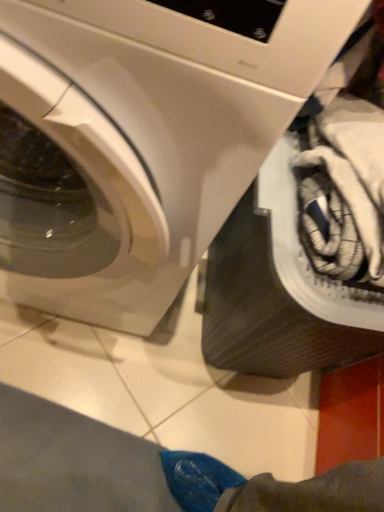
Describe the element at coordinates (266, 309) in the screenshot. I see `black rubber tire at lower right` at that location.

The width and height of the screenshot is (384, 512). Find the location of `black rubber tire at lower right`. black rubber tire at lower right is located at coordinates (266, 309).

The width and height of the screenshot is (384, 512). Describe the element at coordinates (141, 137) in the screenshot. I see `white glossy washing machine at upper left` at that location.

At what (x,y) coordinates should I click in order to perform the action: click on white glossy washing machine at upper left. Please return your answer as a coordinate pair (x, y). This screenshot has height=512, width=384. Looking at the image, I should click on (141, 137).

From the picture: Measure the distance between point [222,134] and camera.

Point [222,134] is 14.33 inches from camera.

Find the location of a particular element. The width and height of the screenshot is (384, 512). black rubber tire at lower right is located at coordinates (266, 309).

Considering the positions of objects black rubber tire at lower right and white glossy washing machine at upper left in the image provided, who is more to the right, black rubber tire at lower right or white glossy washing machine at upper left?

black rubber tire at lower right.

Is black rubber tire at lower right closer to camera compared to white glossy washing machine at upper left?

No, black rubber tire at lower right is behind white glossy washing machine at upper left.

Which is behind, point (255, 312) or point (231, 170)?

The point (255, 312) is farther.

From the image's perspective, which is below, black rubber tire at lower right or white glossy washing machine at upper left?

black rubber tire at lower right is shown below in the image.

From a real-world perspective, which is physically below, black rubber tire at lower right or white glossy washing machine at upper left?

black rubber tire at lower right, from a real-world perspective.

Can you confirm if black rubber tire at lower right is thinner than white glossy washing machine at upper left?

Correct, the width of black rubber tire at lower right is less than that of white glossy washing machine at upper left.

Between black rubber tire at lower right and white glossy washing machine at upper left, which one has less height?

black rubber tire at lower right is shorter.

Is black rubber tire at lower right bigger or smaller than white glossy washing machine at upper left?

In the image, black rubber tire at lower right appears to be smaller than white glossy washing machine at upper left.

From the picture: Would you say black rubber tire at lower right contains white glossy washing machine at upper left?

No, white glossy washing machine at upper left is not surrounded by black rubber tire at lower right.

Is black rubber tire at lower right with white glossy washing machine at upper left?

black rubber tire at lower right and white glossy washing machine at upper left are not in contact.

Could you tell me if black rubber tire at lower right is turned towards white glossy washing machine at upper left?

No.

Locate an element on the screen. The image size is (384, 512). washing machine positioned vertically above the black rubber tire at lower right (from a real-world perspective) is located at coordinates (141, 137).

Between white glossy washing machine at upper left and black rubber tire at lower right, which one appears on the right side from the viewer's perspective?

black rubber tire at lower right is more to the right.

From the picture: Which is behind, white glossy washing machine at upper left or black rubber tire at lower right?

Positioned behind is black rubber tire at lower right.

Between point (187, 181) and point (236, 283), which one is positioned in front?

Point (187, 181)

From the image's perspective, who appears lower, white glossy washing machine at upper left or black rubber tire at lower right?

black rubber tire at lower right appears lower in the image.

From a real-world perspective, who is located lower, white glossy washing machine at upper left or black rubber tire at lower right?

black rubber tire at lower right.

Which object is thinner, white glossy washing machine at upper left or black rubber tire at lower right?

With smaller width is black rubber tire at lower right.

From their relative heights in the image, would you say white glossy washing machine at upper left is taller or shorter than black rubber tire at lower right?

Clearly, white glossy washing machine at upper left is taller compared to black rubber tire at lower right.

Considering the sizes of objects white glossy washing machine at upper left and black rubber tire at lower right in the image provided, who is smaller, white glossy washing machine at upper left or black rubber tire at lower right?

black rubber tire at lower right.

Is white glossy washing machine at upper left inside or outside of black rubber tire at lower right?

white glossy washing machine at upper left is located beyond the bounds of black rubber tire at lower right.

Can you see white glossy washing machine at upper left touching black rubber tire at lower right?

No, white glossy washing machine at upper left is not with black rubber tire at lower right.

Based on the photo, is white glossy washing machine at upper left facing away from black rubber tire at lower right?

white glossy washing machine at upper left is not turned away from black rubber tire at lower right.

How different are the orientations of white glossy washing machine at upper left and black rubber tire at lower right in degrees?

The angle between the facing direction of white glossy washing machine at upper left and the facing direction of black rubber tire at lower right is 8.17 degrees.

Measure the distance from white glossy washing machine at upper left to black rubber tire at lower right.

white glossy washing machine at upper left is 8.86 inches away from black rubber tire at lower right.

The image size is (384, 512). Find the location of `tire that is behind the white glossy washing machine at upper left`. tire that is behind the white glossy washing machine at upper left is located at coordinates (266, 309).

Where is `washing machine that is above the black rubber tire at lower right (from a real-world perspective)`? washing machine that is above the black rubber tire at lower right (from a real-world perspective) is located at coordinates (141, 137).

Identify the location of tire behind the white glossy washing machine at upper left. point(266,309).